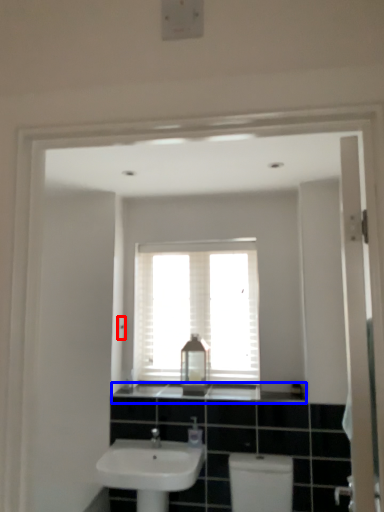
Question: Which object appears closest to the camera in this image, light switch (highlighted by a red box) or counter top (highlighted by a blue box)?

Choices:
 (A) light switch
 (B) counter top

Answer: (B)